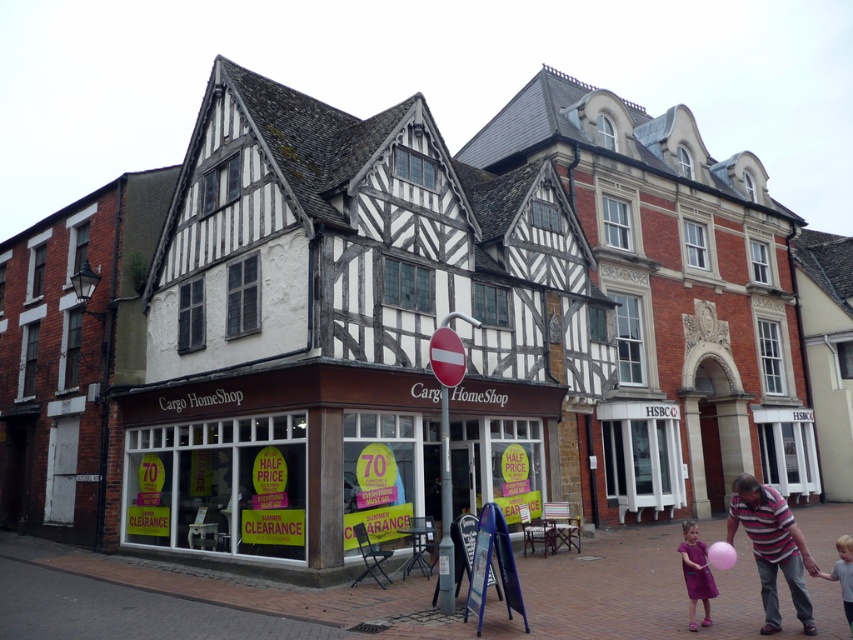
You are a customer standing in front of the matte brown storefront at center. You see the purple satin dress at lower right displayed in the window. If you want to reach the dress quickly, should you walk towards the store entrance or go around the building?

The distance between the matte brown storefront at center and the purple satin dress at lower right is 17.81 meters. Since the dress is displayed in the window, you should walk towards the store entrance to reach it more quickly rather than going around the building.

You are a customer entering Cargo HomeShop and notice two items in the window display. The red plastic sign at center and the purple satin dress at lower right. Which item appears larger in height?

The red plastic sign at center is much taller than the purple satin dress at lower right, so the red plastic sign at center appears larger in height.

You are a customer entering the Cargo HomeShop and notice the red plastic sign at center and the purple satin dress at lower right. Which item is closer to you as you stand at the entrance?

The red plastic sign at center is closer to you because the purple satin dress at lower right is behind it.